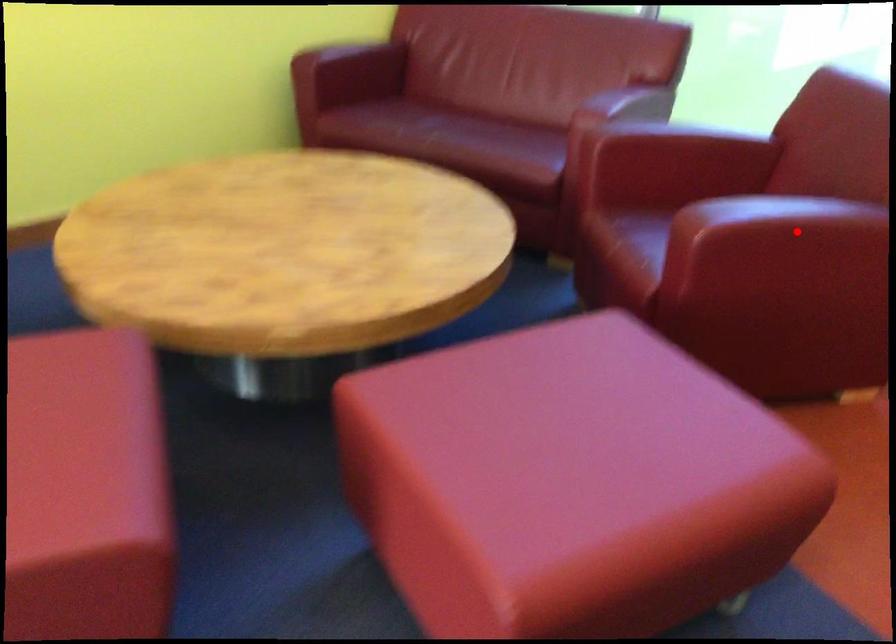
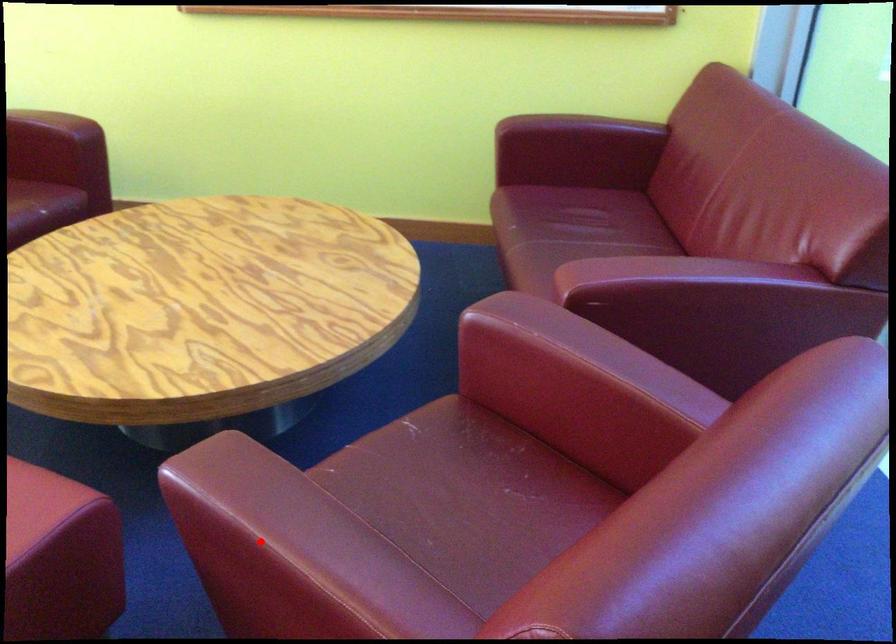
I am providing you with two images of the same scene from different viewpoints. A red point is marked on the first image and another point is marked on the second image. Are the points marked in image1 and image2 representing the same 3D position?

Yes